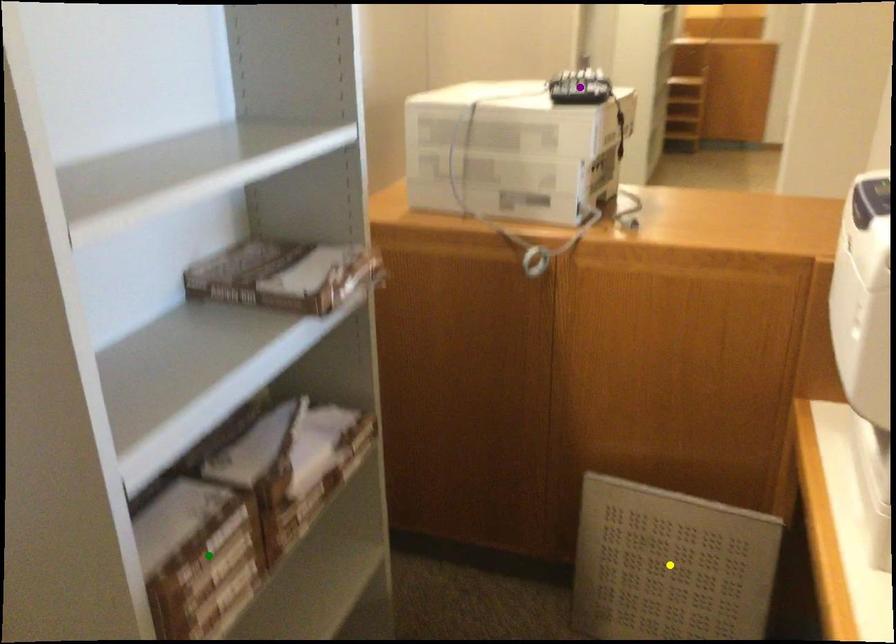
Order these from nearest to farthest:
yellow point | purple point | green point

1. green point
2. purple point
3. yellow point